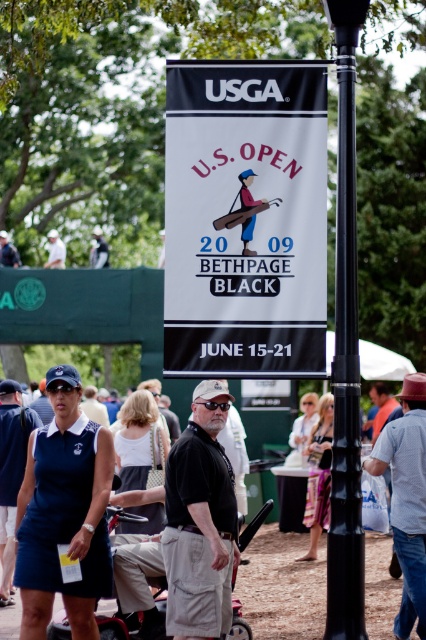
Can you confirm if white paper sign at center is positioned above white cotton shirt at upper left?

No.

Does white paper sign at center have a greater width compared to white cotton shirt at upper left?

Indeed, white paper sign at center has a greater width compared to white cotton shirt at upper left.

Does point (249, 372) come in front of point (46, 266)?

Yes, it is.

I want to click on white paper sign at center, so click(245, 218).

Is navy blue fabric dress at center shorter than red plastic baby carriage at lower center?

In fact, navy blue fabric dress at center may be taller than red plastic baby carriage at lower center.

Does navy blue fabric dress at center appear on the left side of red plastic baby carriage at lower center?

Yes, navy blue fabric dress at center is to the left of red plastic baby carriage at lower center.

Between point (46, 541) and point (236, 609), which one is positioned in front?

Point (46, 541)

Identify the location of navy blue fabric dress at center. (63, 513).

This screenshot has height=640, width=426. What are the coordinates of `white paper sign at center` in the screenshot? It's located at (245, 218).

Does white paper sign at center appear on the right side of red plastic baby carriage at lower center?

No, white paper sign at center is not to the right of red plastic baby carriage at lower center.

Which is behind, point (239, 129) or point (60, 628)?

Point (60, 628)

Where is `white paper sign at center`? This screenshot has width=426, height=640. white paper sign at center is located at coordinates (245, 218).